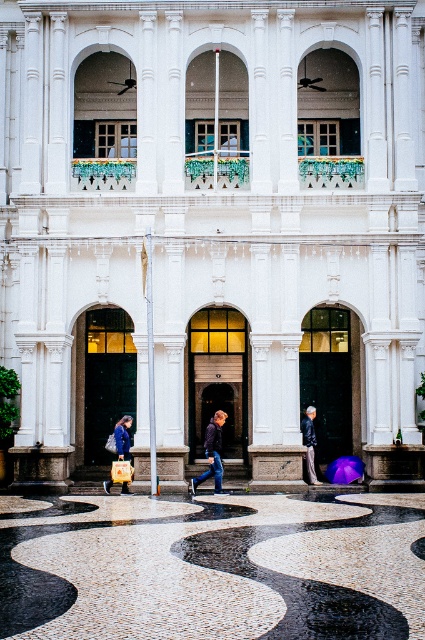
Question: Which of these objects is positioned closest to the blue denim jacket at lower left?

Choices:
 (A) transparent purple umbrella at center
 (B) leather jacket at lower center
 (C) denim jacket at center

Answer: (C)

Question: Among these objects, which one is farthest from the camera?

Choices:
 (A) denim jacket at center
 (B) transparent purple umbrella at center
 (C) leather jacket at lower center
 (D) blue denim jacket at lower left

Answer: (B)

Question: Can you confirm if denim jacket at center is positioned above transparent purple umbrella at center?

Choices:
 (A) no
 (B) yes

Answer: (B)

Question: Estimate the real-world distances between objects in this image. Which object is farther from the transparent purple umbrella at center?

Choices:
 (A) blue denim jacket at lower left
 (B) leather jacket at lower center
 (C) denim jacket at center

Answer: (A)

Question: Is denim jacket at center smaller than transparent purple umbrella at center?

Choices:
 (A) no
 (B) yes

Answer: (B)

Question: Observing the image, what is the correct spatial positioning of denim jacket at center in reference to leather jacket at lower center?

Choices:
 (A) left
 (B) right

Answer: (A)